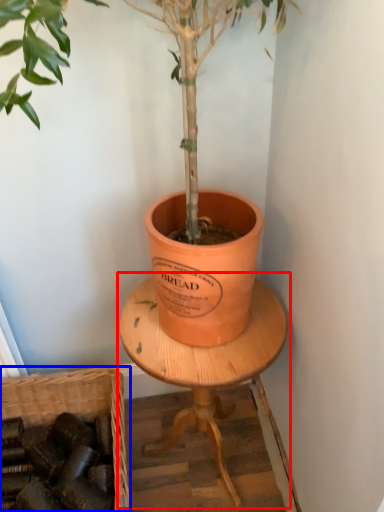
Question: Which object is further to the camera taking this photo, round table (highlighted by a red box) or basket (highlighted by a blue box)?

Choices:
 (A) round table
 (B) basket

Answer: (B)